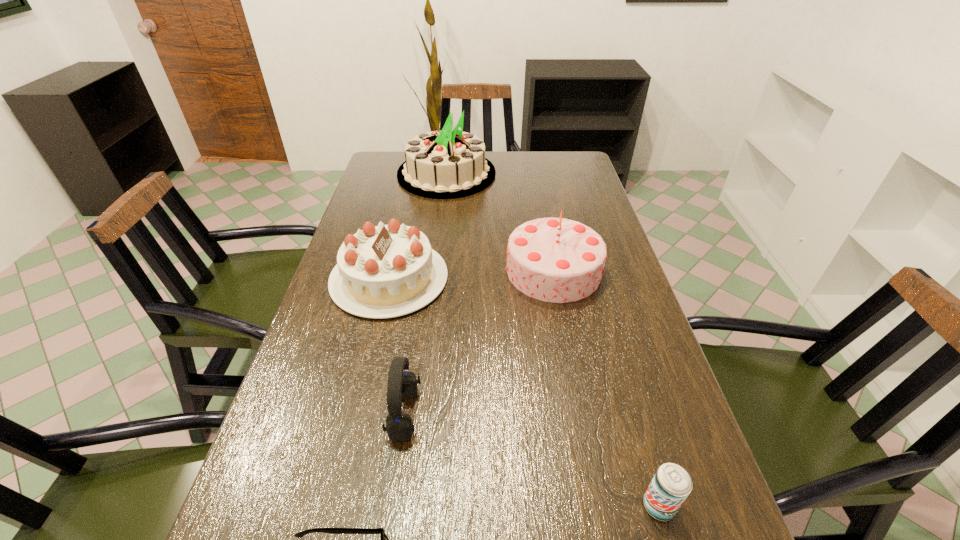
Where is `the tallest object`? the tallest object is located at coordinates (444, 164).

You are a GUI agent. You are given a task and a screenshot of the screen. Output one action in this format:
    pyautogui.click(x=<x>, y=<y>)
    Task: Click on the farthest object
    The image size is (960, 540).
    Given the screenshot: What is the action you would take?
    pyautogui.click(x=444, y=164)

The image size is (960, 540). What are the coordinates of `the rightmost birthday cake` in the screenshot? It's located at (559, 260).

Locate an element on the screen. The height and width of the screenshot is (540, 960). the second tallest birthday cake is located at coordinates (559, 260).

Where is `the shortest birthday cake`? the shortest birthday cake is located at coordinates (384, 271).

Where is `the fourth farthest object`? The height and width of the screenshot is (540, 960). the fourth farthest object is located at coordinates (401, 383).

The height and width of the screenshot is (540, 960). I want to click on the fifth farthest object, so click(671, 485).

Image resolution: width=960 pixels, height=540 pixels. Find the location of `the fifth tallest object`. the fifth tallest object is located at coordinates (671, 485).

The image size is (960, 540). Identify the location of vacant space located on the right of the farthest birthday cake. (528, 174).

At what (x,y) coordinates should I click in order to perform the action: click on free space located on the back of the second tallest birthday cake. Please return your answer as a coordinate pair (x, y). Looking at the image, I should click on (542, 214).